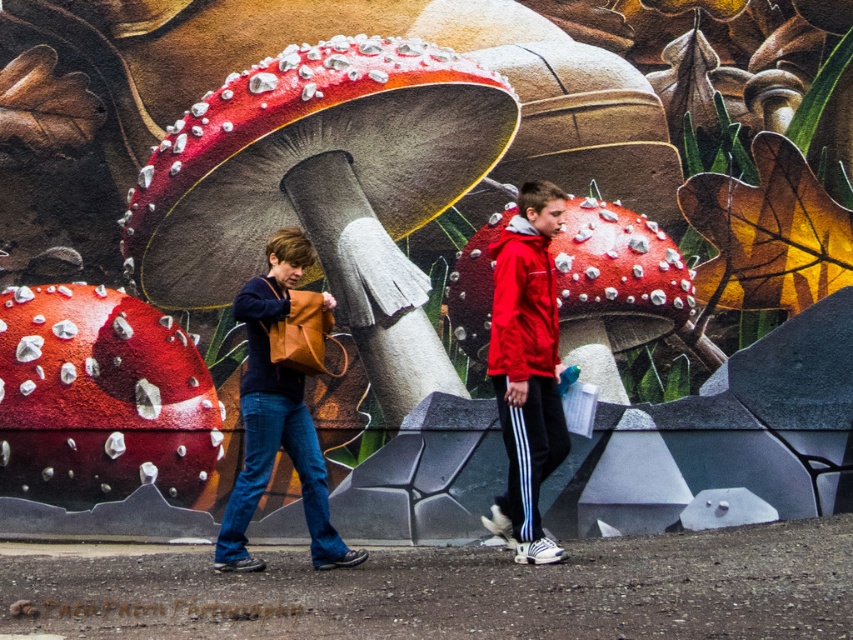
You are a fashion designer observing two people walking past a mural. You notice the red matte jacket at center and the matte red jacket at center. Which one is positioned lower in the image?

The red matte jacket at center is positioned lower than the matte red jacket at center in the image.

You are a photographer trying to capture both the red matte jacket at center and the matte red jacket at center in a single shot. Given that your camera has a maximum focus range of 4 inches, will you be able to get both subjects in focus?

The red matte jacket at center and the matte red jacket at center are 4.31 inches apart. Since the distance between them exceeds the camera focus range of 4 inches, you will not be able to capture both in focus simultaneously.